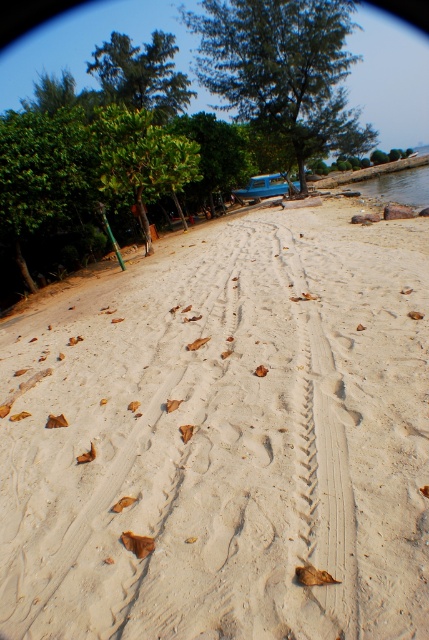
You are planning to set up a picnic area in this beach scene. You want to choose between the two green leafy trees for shade. Which tree would provide more shade coverage? Please refer to the trees labeled as green leafy tree at upper center and green leafy tree at center.

The green leafy tree at upper center is larger in size than the green leafy tree at center, so it would provide more shade coverage.

You are planning to set up a picnic area on the beach. Considering the green leafy tree at left and the green leafy tree at center, which tree would provide more shade for your picnic basket?

The green leafy tree at left is larger in size compared to the green leafy tree at center, so it would provide more shade for the picnic basket.

You are standing on the beach looking at the scene. There are two points marked in the image, point A at coordinates point (105, 144) and point B at coordinates point (230, 138). Which point is closer to you?

Point A at coordinates point (105, 144) is closer to the viewer than point B at coordinates point (230, 138).